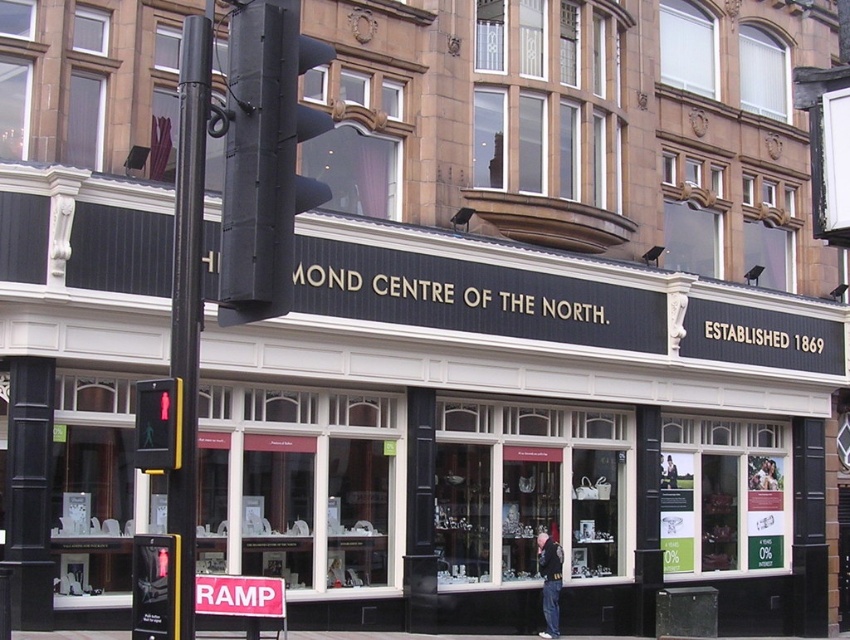
You are standing at the point marked as point (234, 17) and want to cross the street to reach the Diamond Centre of the North. Given that the traffic signal pole is in the foreground on the left side, can you safely cross the street right now?

The pedestrian crossing signal at the traffic signal pole on the left side shows a red figure, indicating that pedestrians should not cross at this moment. Therefore, you cannot safely cross the street right now.

You are a pedestrian waiting at the crosswalk. You see the black glass storefront at center and the red plastic pedestrian signal at left. Which object is closer to you?

The black glass storefront at center is closer to you than the red plastic pedestrian signal at left.

You are a delivery driver approaching the Diamond Centre of the North. You need to park your vehicle near the traffic signal pole on the left. Is there enough space between the traffic signal pole on the left and the red plastic pedestrian signal at point (157, 424) to safely park your vehicle?

The red plastic pedestrian signal at point (157, 424) is located at the traffic signal pole on the left, so there is no space between them. Therefore, you cannot park your vehicle between them.